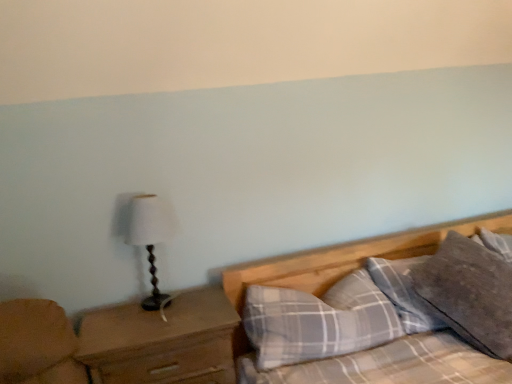
Locate an element on the screen. The width and height of the screenshot is (512, 384). free point in front of wooden table lamp at left is located at coordinates (169, 326).